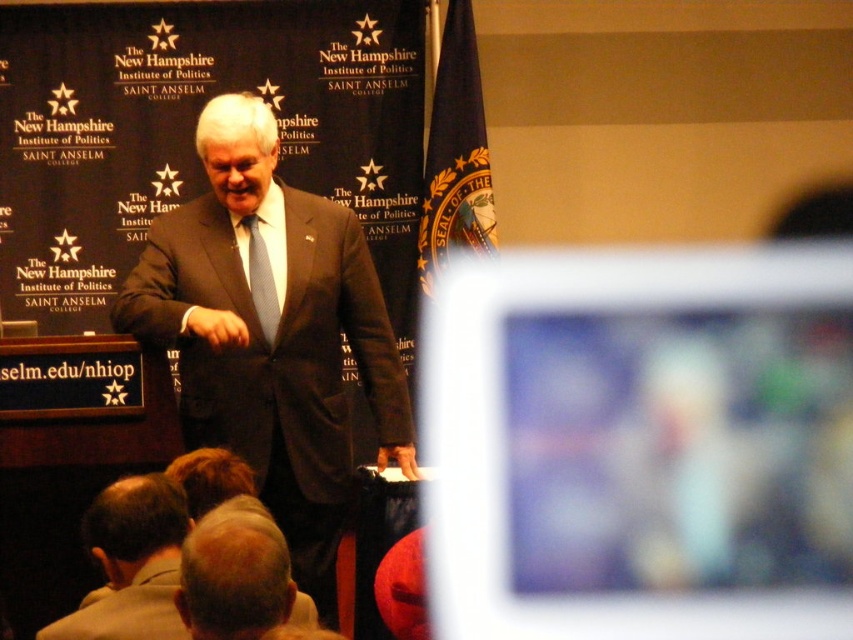
Is the position of light brown hair at lower center less distant than that of light blue textured tie at center?

Yes, light brown hair at lower center is closer to the viewer.

Does light brown hair at lower center have a greater height compared to light blue textured tie at center?

Incorrect, light brown hair at lower center's height is not larger of light blue textured tie at center's.

Is point (293, 586) closer to viewer compared to point (248, 269)?

Yes, point (293, 586) is in front of point (248, 269).

The height and width of the screenshot is (640, 853). What are the coordinates of `light brown hair at lower center` in the screenshot? It's located at (235, 573).

Looking at this image, between light brown hair at lower left and light blue textured tie at center, which one has more height?

light blue textured tie at center is taller.

Which is below, light brown hair at lower left or light blue textured tie at center?

light brown hair at lower left is lower down.

Between point (80, 618) and point (260, 241), which one is positioned in front?

Point (80, 618)

You are a GUI agent. You are given a task and a screenshot of the screen. Output one action in this format:
    pyautogui.click(x=<x>, y=<y>)
    Task: Click on the light brown hair at lower left
    This screenshot has width=853, height=640.
    Given the screenshot: What is the action you would take?
    pyautogui.click(x=132, y=563)

What do you see at coordinates (276, 333) in the screenshot? I see `dark brown suit at center` at bounding box center [276, 333].

Is point (379, 316) less distant than point (259, 298)?

No, it is behind (259, 298).

This screenshot has width=853, height=640. In order to click on dark brown suit at center in this screenshot , I will do `click(276, 333)`.